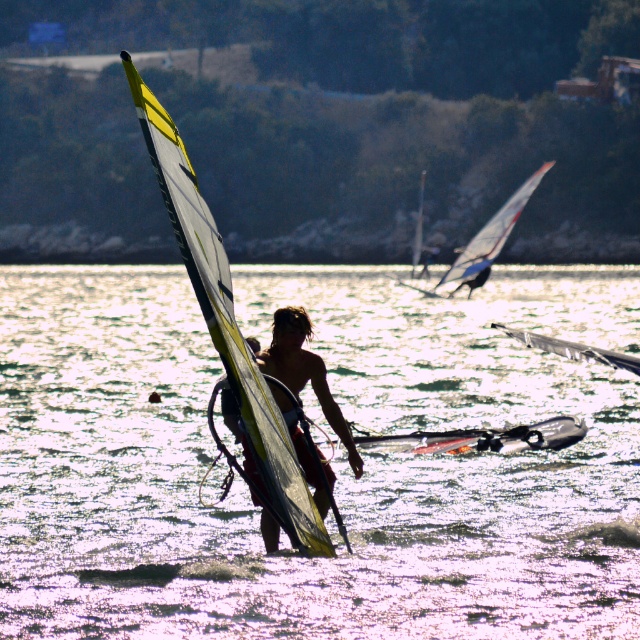
Question: Which point appears closest to the camera in this image?

Choices:
 (A) (289, 332)
 (B) (465, 444)

Answer: (A)

Question: Which of the following is the closest to the observer?

Choices:
 (A) (528, 182)
 (B) (269, 628)
 (C) (241, 376)
 (D) (360, 461)

Answer: (B)

Question: Can you confirm if yellow and white sail at center is bigger than white glossy sail at upper center?

Choices:
 (A) no
 (B) yes

Answer: (B)

Question: Can you confirm if yellow and white sail at center is positioned above white glossy sail at upper center?

Choices:
 (A) yes
 (B) no

Answer: (A)

Question: Which point is farther from the camera taking this photo?

Choices:
 (A) (252, 442)
 (B) (376, 476)
 (C) (328, 502)
 (D) (522, 442)

Answer: (B)

Question: Can you confirm if white glossy surfboard at center is wider than white glossy sail at upper center?

Choices:
 (A) yes
 (B) no

Answer: (B)